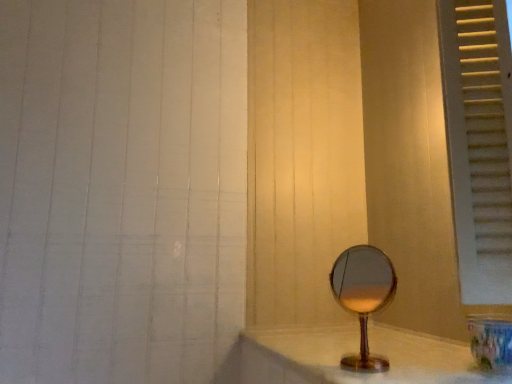
Question: Is white painted wood window frame at right positioned with its back to wooden mirror at center?

Choices:
 (A) no
 (B) yes

Answer: (A)

Question: From the image's perspective, is white painted wood window frame at right below wooden mirror at center?

Choices:
 (A) yes
 (B) no

Answer: (B)

Question: Does white painted wood window frame at right lie in front of wooden mirror at center?

Choices:
 (A) yes
 (B) no

Answer: (A)

Question: Are white painted wood window frame at right and wooden mirror at center beside each other?

Choices:
 (A) no
 (B) yes

Answer: (A)

Question: Is white painted wood window frame at right aimed at wooden mirror at center?

Choices:
 (A) yes
 (B) no

Answer: (B)

Question: From the image's perspective, would you say white painted wood window frame at right is positioned over wooden mirror at center?

Choices:
 (A) no
 (B) yes

Answer: (B)

Question: Are wooden mirror at center and white painted wood window frame at right beside each other?

Choices:
 (A) yes
 (B) no

Answer: (B)

Question: Can you confirm if wooden mirror at center is shorter than white painted wood window frame at right?

Choices:
 (A) no
 (B) yes

Answer: (B)

Question: Is wooden mirror at center positioned before white painted wood window frame at right?

Choices:
 (A) yes
 (B) no

Answer: (B)

Question: Does wooden mirror at center have a greater width compared to white painted wood window frame at right?

Choices:
 (A) yes
 (B) no

Answer: (B)

Question: Is wooden mirror at center positioned far away from white painted wood window frame at right?

Choices:
 (A) no
 (B) yes

Answer: (A)

Question: Is wooden mirror at center taller than white painted wood window frame at right?

Choices:
 (A) yes
 (B) no

Answer: (B)

Question: From a real-world perspective, is white painted wood window frame at right over translucent glass mirror at lower right?

Choices:
 (A) yes
 (B) no

Answer: (A)